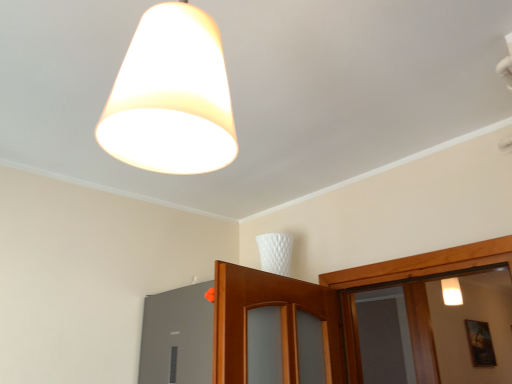
Question: Is the position of wooden framed picture at lower right more distant than that of white matte lampshade at upper center?

Choices:
 (A) yes
 (B) no

Answer: (A)

Question: Considering the relative sizes of wooden framed picture at lower right and white matte lampshade at upper center in the image provided, is wooden framed picture at lower right taller than white matte lampshade at upper center?

Choices:
 (A) no
 (B) yes

Answer: (B)

Question: Is wooden framed picture at lower right wider than white matte lampshade at upper center?

Choices:
 (A) no
 (B) yes

Answer: (A)

Question: Considering the relative sizes of wooden framed picture at lower right and white matte lampshade at upper center in the image provided, is wooden framed picture at lower right thinner than white matte lampshade at upper center?

Choices:
 (A) yes
 (B) no

Answer: (A)

Question: From the image's perspective, is wooden framed picture at lower right above white matte lampshade at upper center?

Choices:
 (A) no
 (B) yes

Answer: (A)

Question: Considering the positions of matte gray window at lower left and wooden framed picture at lower right in the image, is matte gray window at lower left taller or shorter than wooden framed picture at lower right?

Choices:
 (A) tall
 (B) short

Answer: (B)

Question: Considering their positions, is matte gray window at lower left located in front of or behind wooden framed picture at lower right?

Choices:
 (A) front
 (B) behind

Answer: (A)

Question: Is matte gray window at lower left bigger or smaller than wooden framed picture at lower right?

Choices:
 (A) big
 (B) small

Answer: (B)

Question: Visually, is matte gray window at lower left positioned to the left or to the right of wooden framed picture at lower right?

Choices:
 (A) left
 (B) right

Answer: (A)

Question: Is wooden framed picture at lower right in front of or behind white matte lampshade at upper center in the image?

Choices:
 (A) front
 (B) behind

Answer: (B)

Question: In terms of width, does wooden framed picture at lower right look wider or thinner when compared to white matte lampshade at upper center?

Choices:
 (A) wide
 (B) thin

Answer: (B)

Question: Is wooden framed picture at lower right taller or shorter than white matte lampshade at upper center?

Choices:
 (A) short
 (B) tall

Answer: (B)

Question: In the image, is wooden framed picture at lower right on the left side or the right side of white matte lampshade at upper center?

Choices:
 (A) left
 (B) right

Answer: (B)

Question: Is wooden framed picture at lower right in front of or behind matte gray window at lower left in the image?

Choices:
 (A) front
 (B) behind

Answer: (B)

Question: Is wooden framed picture at lower right spatially inside matte gray window at lower left, or outside of it?

Choices:
 (A) inside
 (B) outside

Answer: (B)